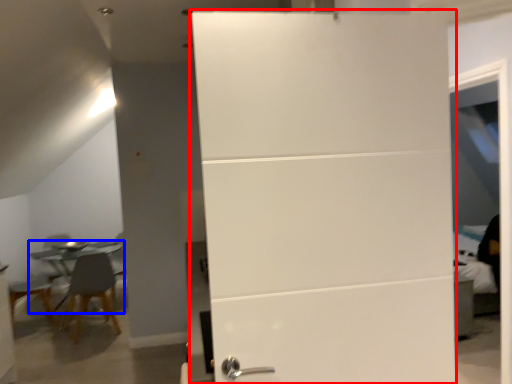
Question: Which object appears farthest to the camera in this image, door (highlighted by a red box) or table (highlighted by a blue box)?

Choices:
 (A) door
 (B) table

Answer: (B)